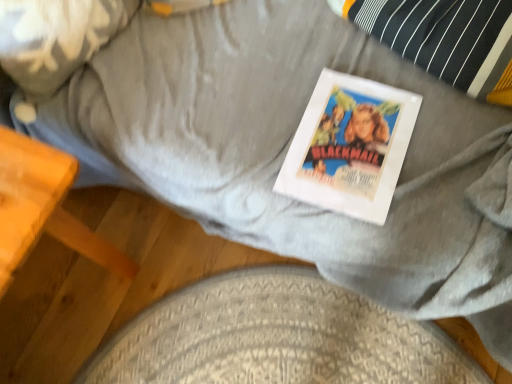
Question: From their relative heights in the image, would you say fluffy white pillow at upper left is taller or shorter than white paper at center?

Choices:
 (A) short
 (B) tall

Answer: (B)

Question: Is fluffy white pillow at upper left wider or thinner than white paper at center?

Choices:
 (A) thin
 (B) wide

Answer: (A)

Question: Which of these objects is positioned farthest from the fluffy white pillow at upper left?

Choices:
 (A) textured gray dog bed at lower center
 (B) wooden table at lower left
 (C) white paper at center

Answer: (A)

Question: Estimate the real-world distances between objects in this image. Which object is closer to the white paper at center?

Choices:
 (A) textured gray dog bed at lower center
 (B) wooden table at lower left
 (C) fluffy white pillow at upper left

Answer: (A)